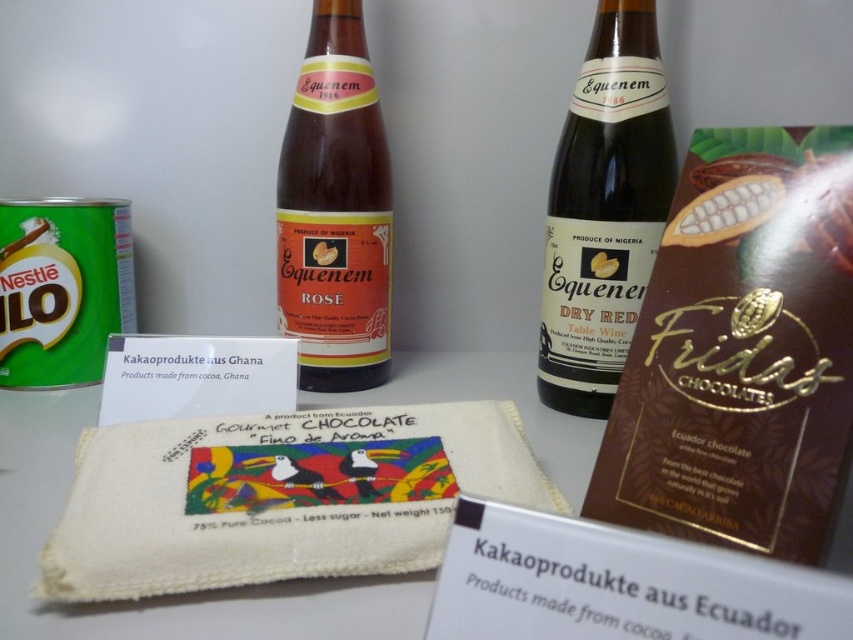
Which is in front, point (608, 52) or point (361, 140)?

Point (608, 52)

Does brown glass bottle at center appear on the left side of matte glass bottle at center?

Incorrect, brown glass bottle at center is not on the left side of matte glass bottle at center.

Identify the location of brown glass bottle at center. (x=605, y=202).